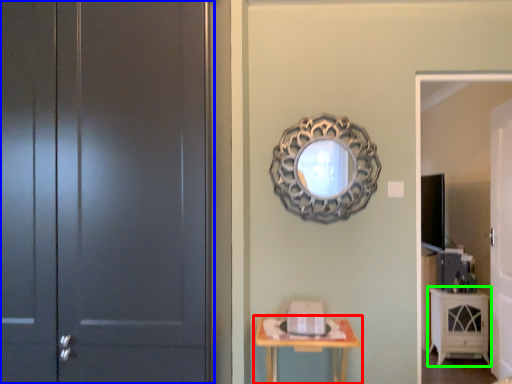
Question: Based on their relative distances, which object is nearer to table (highlighted by a red box)? Choose from door (highlighted by a blue box) and cabinetry (highlighted by a green box).

Choices:
 (A) door
 (B) cabinetry

Answer: (A)